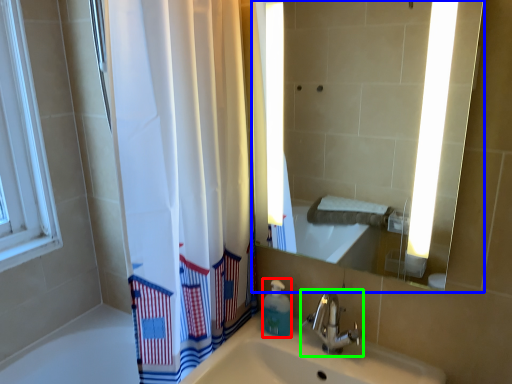
Question: Which object is positioned closest to soap dispenser (highlighted by a red box)? Select from mirror (highlighted by a blue box) and tap (highlighted by a green box).

Choices:
 (A) mirror
 (B) tap

Answer: (B)